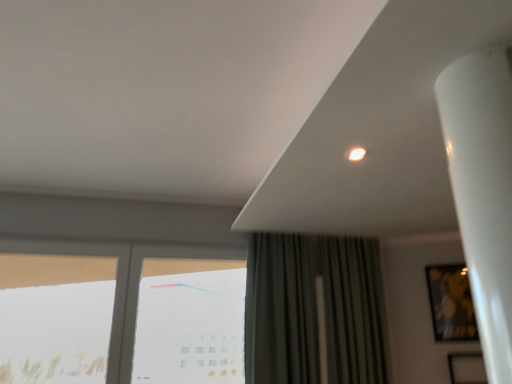
Question: From the image's perspective, is dark green fabric curtain at center over transparent glass window at lower left, marked as the second window in a right-to-left arrangement?

Choices:
 (A) yes
 (B) no

Answer: (A)

Question: From a real-world perspective, is dark green fabric curtain at center under transparent glass window at lower left, the second window positioned from the left?

Choices:
 (A) yes
 (B) no

Answer: (B)

Question: Is dark green fabric curtain at center positioned before transparent glass window at lower left, the second window positioned from the left?

Choices:
 (A) yes
 (B) no

Answer: (B)

Question: Is dark green fabric curtain at center wider than transparent glass window at lower left, marked as the second window in a right-to-left arrangement?

Choices:
 (A) no
 (B) yes

Answer: (B)

Question: Can you confirm if dark green fabric curtain at center is positioned to the right of transparent glass window at lower left, the second window positioned from the left?

Choices:
 (A) yes
 (B) no

Answer: (A)

Question: Is dark green fabric curtain at center looking in the opposite direction of transparent glass window at lower left, marked as the second window in a right-to-left arrangement?

Choices:
 (A) no
 (B) yes

Answer: (A)

Question: Is transparent glass window at center, which ranks as the first window in right-to-left order, turned away from metallic gold picture frame at right?

Choices:
 (A) no
 (B) yes

Answer: (A)

Question: Considering the relative sizes of transparent glass window at center, which ranks as the first window in right-to-left order, and metallic gold picture frame at right in the image provided, is transparent glass window at center, which ranks as the first window in right-to-left order, wider than metallic gold picture frame at right?

Choices:
 (A) yes
 (B) no

Answer: (A)

Question: Does transparent glass window at center, marked as the 3th window in a left-to-right arrangement, have a greater height compared to metallic gold picture frame at right?

Choices:
 (A) no
 (B) yes

Answer: (B)

Question: Is transparent glass window at center, which ranks as the first window in right-to-left order, thinner than metallic gold picture frame at right?

Choices:
 (A) yes
 (B) no

Answer: (B)

Question: Does transparent glass window at center, which ranks as the first window in right-to-left order, touch metallic gold picture frame at right?

Choices:
 (A) yes
 (B) no

Answer: (B)

Question: Would you say metallic gold picture frame at right is part of transparent glass window at center, which ranks as the first window in right-to-left order,'s contents?

Choices:
 (A) yes
 (B) no

Answer: (B)

Question: Is transparent glass window at left, positioned as the 1th window in left-to-right order, aimed at metallic gold picture frame at right?

Choices:
 (A) no
 (B) yes

Answer: (A)